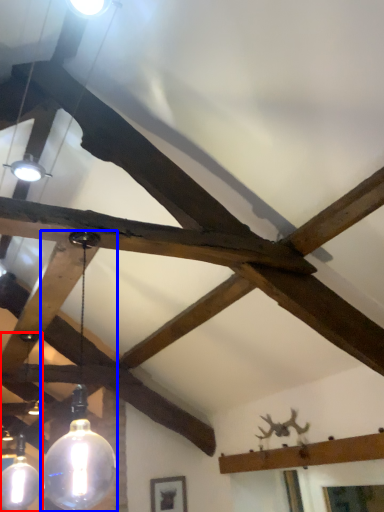
Question: Among these objects, which one is farthest to the camera, lamp (highlighted by a red box) or lamp (highlighted by a blue box)?

Choices:
 (A) lamp
 (B) lamp

Answer: (A)